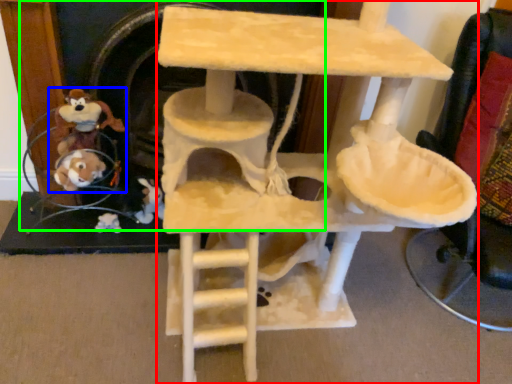
Question: Estimate the real-world distances between objects in this image. Which object is farther from furniture (highlighted by a red box), toy (highlighted by a blue box) or fireplace (highlighted by a green box)?

Choices:
 (A) toy
 (B) fireplace

Answer: (A)